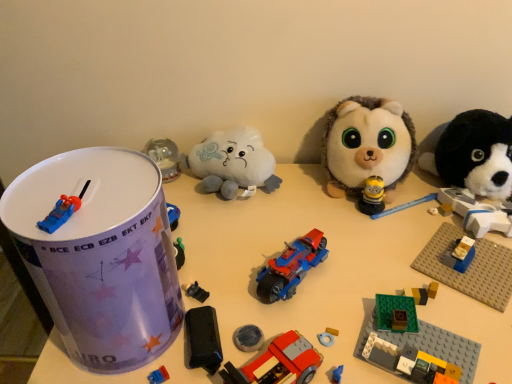
Locate an element on the screen. The width and height of the screenshot is (512, 384). vacant space situated on the left part of green plastic building block at lower right, which is the 7th toy from left to right is located at coordinates (279, 316).